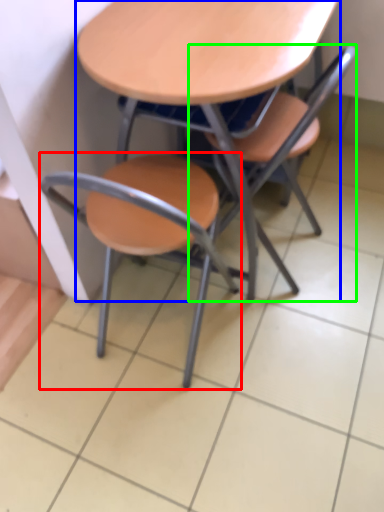
Question: Considering the real-world distances, which object is farthest from chair (highlighted by a red box)? table (highlighted by a blue box) or chair (highlighted by a green box)?

Choices:
 (A) table
 (B) chair

Answer: (A)